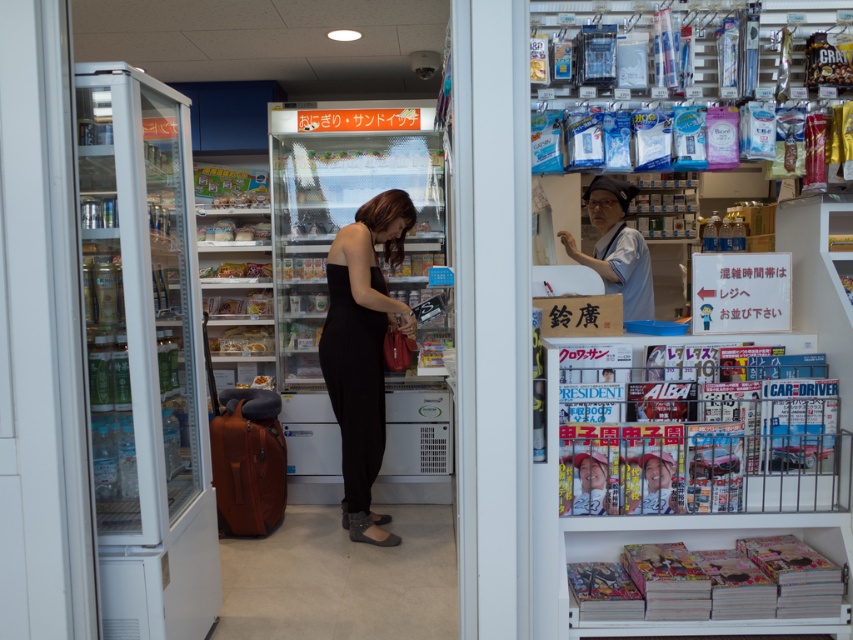
Question: Is white uniform at center closer to camera compared to matte black magazine at center?

Choices:
 (A) no
 (B) yes

Answer: (A)

Question: Which of the following is the closest to the observer?

Choices:
 (A) (606, 474)
 (B) (631, 264)

Answer: (A)

Question: Which object appears farthest from the camera in this image?

Choices:
 (A) black matte dress at center
 (B) white uniform at center
 (C) matte black magazine at center
 (D) matte black dress at center

Answer: (A)

Question: Can you confirm if soft cover manga at lower right is thinner than white uniform at center?

Choices:
 (A) no
 (B) yes

Answer: (A)

Question: Based on their relative distances, which object is nearer to the black matte dress at center?

Choices:
 (A) soft cover manga at lower right
 (B) matte black magazine at center
 (C) white uniform at center
 (D) matte black dress at center

Answer: (C)

Question: Is black matte dress at center smaller than matte black dress at center?

Choices:
 (A) yes
 (B) no

Answer: (B)